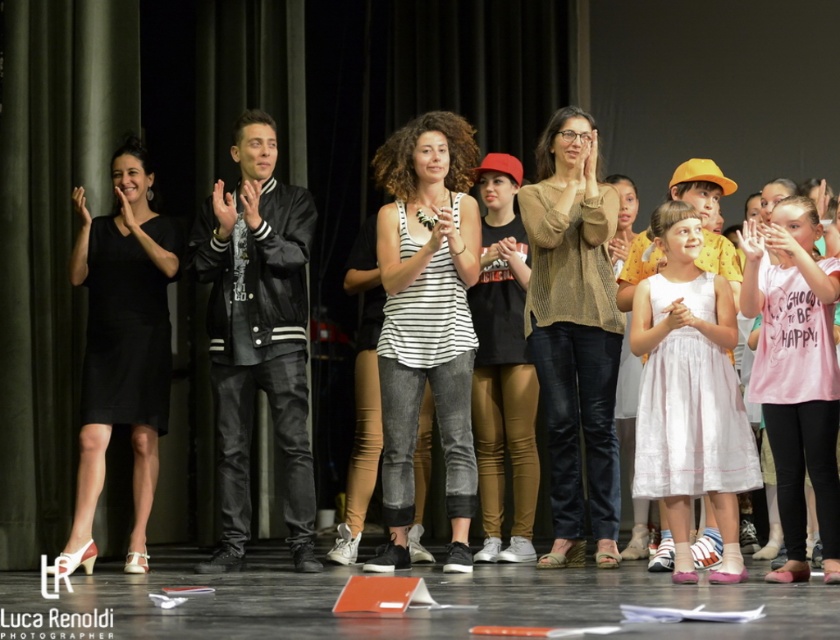
Which is in front, point (676, 250) or point (815, 340)?

Point (815, 340)

Does white tulle dress at center have a smaller size compared to pink cotton shirt at center?

No.

Is point (751, 458) positioned behind point (756, 250)?

Yes, it is.

You are a GUI agent. You are given a task and a screenshot of the screen. Output one action in this format:
    pyautogui.click(x=<x>, y=<y>)
    Task: Click on the white tulle dress at center
    The height and width of the screenshot is (640, 840).
    Given the screenshot: What is the action you would take?
    pyautogui.click(x=689, y=394)

Does white striped tank top at center lie behind black satin dress at center?

That is True.

Does point (390, 298) come closer to viewer compared to point (134, 420)?

Yes, point (390, 298) is in front of point (134, 420).

This screenshot has width=840, height=640. Identify the location of white striped tank top at center. (426, 321).

Identify the location of white striped tank top at center. (426, 321).

Is point (588, 490) farther from viewer compared to point (531, 472)?

Yes, it is behind point (531, 472).

Can you confirm if knitted beige sweater at center is smaller than black matte t-shirt at center?

No.

Between point (531, 298) and point (529, 442), which one is positioned behind?

Point (529, 442)

I want to click on knitted beige sweater at center, so click(575, 333).